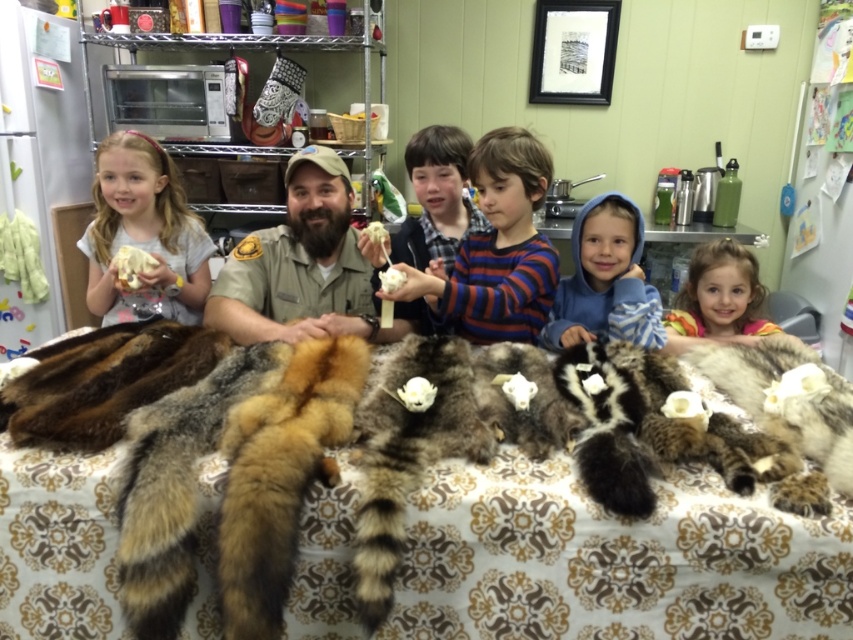
Question: Is light brown fur at left positioned in front of blue fleece hoodie at center?

Choices:
 (A) no
 (B) yes

Answer: (A)

Question: Does brown uniform at center come behind blue fleece hoodie at center?

Choices:
 (A) no
 (B) yes

Answer: (A)

Question: Which point appears farthest from the camera in this image?

Choices:
 (A) (605, 321)
 (B) (367, 304)
 (C) (375, 227)
 (D) (107, 292)

Answer: (D)

Question: Among these points, which one is nearest to the camera?

Choices:
 (A) (633, 321)
 (B) (375, 234)

Answer: (B)

Question: Considering the relative positions of brown uniform at center and brown fur coat at center in the image provided, where is brown uniform at center located with respect to brown fur coat at center?

Choices:
 (A) left
 (B) right

Answer: (A)

Question: Which object is closer to the camera taking this photo?

Choices:
 (A) white fluffy food at left
 (B) blonde hair at lower right
 (C) striped cotton shirt at center
 (D) brown uniform at center

Answer: (C)